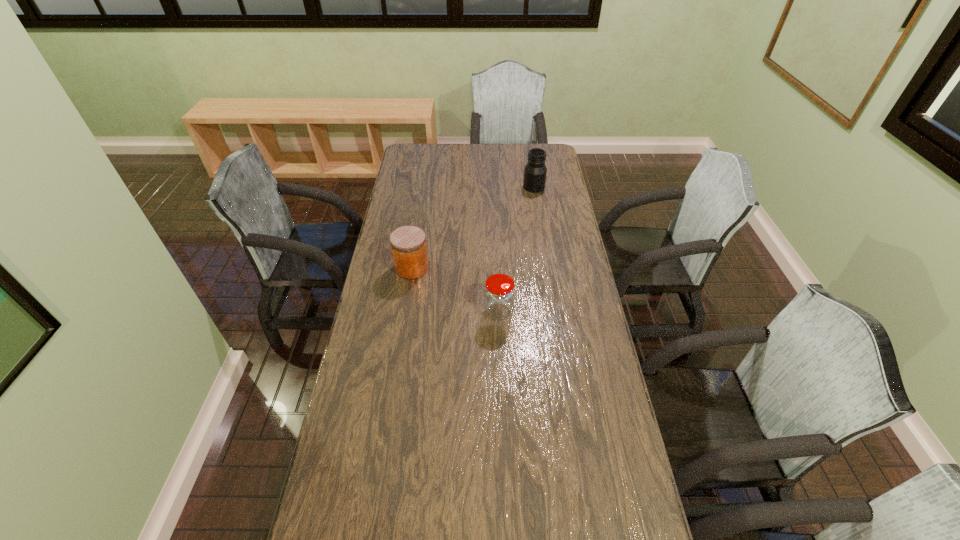
At what (x,y) coordinates should I click in order to perform the action: click on object present at the right edge. Please return your answer as a coordinate pair (x, y). This screenshot has width=960, height=540. Looking at the image, I should click on (535, 171).

In the image, there is a desktop. Where is `vacant area at the far edge`? Image resolution: width=960 pixels, height=540 pixels. vacant area at the far edge is located at coordinates (480, 153).

Locate an element on the screen. Image resolution: width=960 pixels, height=540 pixels. free space at the left edge of the desktop is located at coordinates (382, 514).

Image resolution: width=960 pixels, height=540 pixels. In the image, there is a desktop. In order to click on blank space at the right edge in this screenshot , I will do `click(548, 220)`.

This screenshot has width=960, height=540. I want to click on vacant space at the far left corner, so click(x=416, y=160).

Find the location of a particular element. vacant region at the far right corner of the desktop is located at coordinates (536, 145).

You are a GUI agent. You are given a task and a screenshot of the screen. Output one action in this format:
    pyautogui.click(x=<x>, y=<y>)
    Task: Click on the vacant region between the nearest jar and the farthest object
    
    Given the screenshot: What is the action you would take?
    pyautogui.click(x=516, y=249)

Identify the location of free space between the leftmost object and the second jar from left to right. The width and height of the screenshot is (960, 540). (455, 290).

Where is `vacant area that lies between the leftmost object and the second jar from right to left`? vacant area that lies between the leftmost object and the second jar from right to left is located at coordinates (455, 290).

Identify which object is the nearest to the farthest object. Please provide its 2D coordinates. Your answer should be formatted as a tuple, i.e. [(x, y)], where the tuple contains the x and y coordinates of a point satisfying the conditions above.

[(408, 243)]